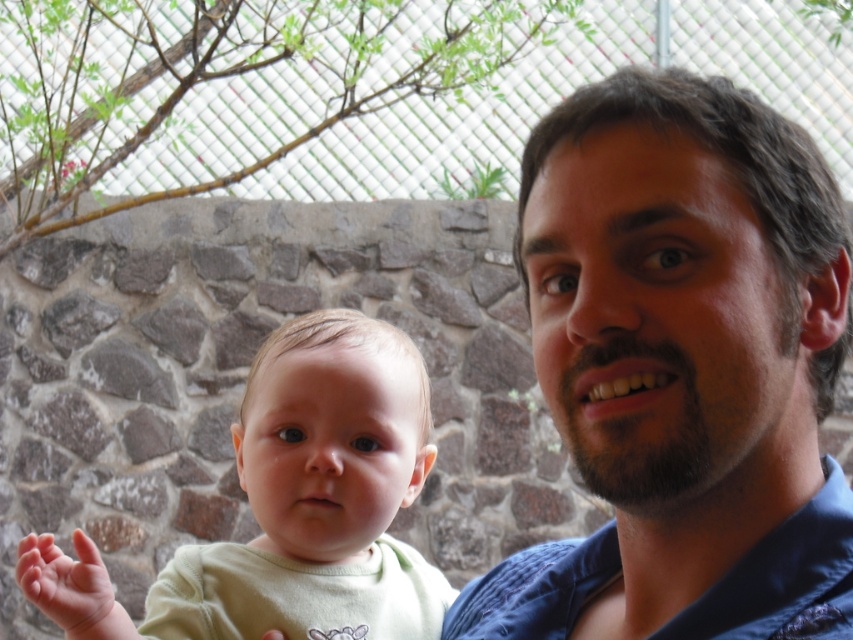
Question: Which of the following is the farthest from the observer?

Choices:
 (A) soft pink skin at lower left
 (B) light green fabric baby at center

Answer: (B)

Question: Does dark blue fabric at center appear on the right side of soft pink skin at lower left?

Choices:
 (A) no
 (B) yes

Answer: (B)

Question: Estimate the real-world distances between objects in this image. Which object is farther from the light green fabric baby at center?

Choices:
 (A) dark blue fabric at center
 (B) soft pink skin at lower left

Answer: (A)

Question: Is dark blue fabric at center to the right of light green fabric baby at center from the viewer's perspective?

Choices:
 (A) no
 (B) yes

Answer: (B)

Question: Is dark blue fabric at center positioned in front of soft pink skin at lower left?

Choices:
 (A) yes
 (B) no

Answer: (A)

Question: Which point is farther from the camera taking this photo?

Choices:
 (A) (825, 269)
 (B) (134, 637)
 (C) (258, 483)

Answer: (C)